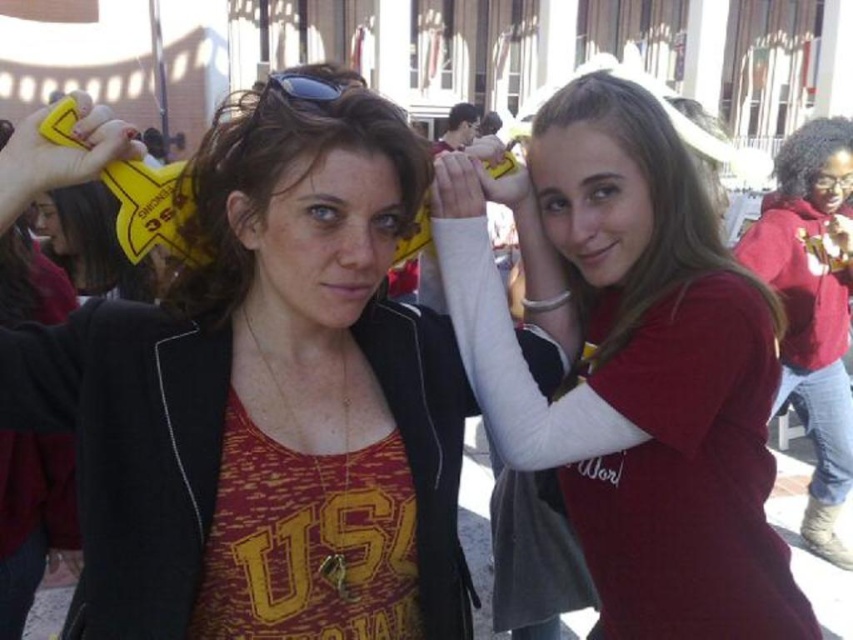
You are a photographer at the event and need to frame both the matte black jacket at center and the matte red shirt at center in your shot. Based on their positions, which object is wider and should be prioritized to ensure it fits properly in the frame?

The matte black jacket at center is wider than the matte red shirt at center, so it should be prioritized to ensure it fits properly in the frame.

You are a photographer trying to capture a closeup of the matte black hair at center and the black rubber goggles at upper center. Which object should you zoom in on to ensure both fit in the frame without cropping?

The matte black hair at center occupies less space than the black rubber goggles at upper center, so you should zoom in on the black rubber goggles at upper center to ensure both fit in the frame without cropping.

From the picture: You are a photographer at the event and want to ensure both the matte black jacket at center and the matte red shirt at center are visible in your photo. Based on their positions, which one is shorter and might need to be framed differently?

The matte black jacket at center has a lesser height compared to the matte red shirt at center, so it might need to be framed differently to ensure visibility.